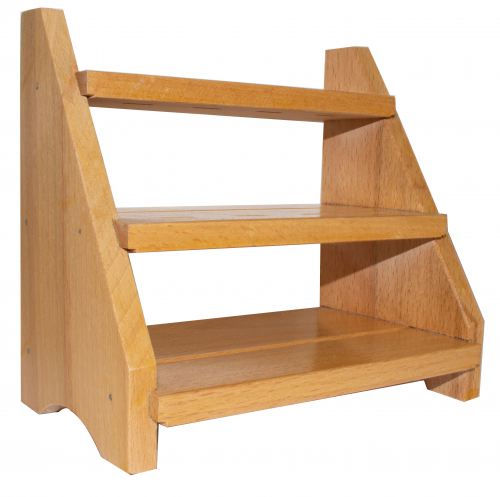
The image size is (500, 497). Identify the location of edge of staircase. (343, 47).